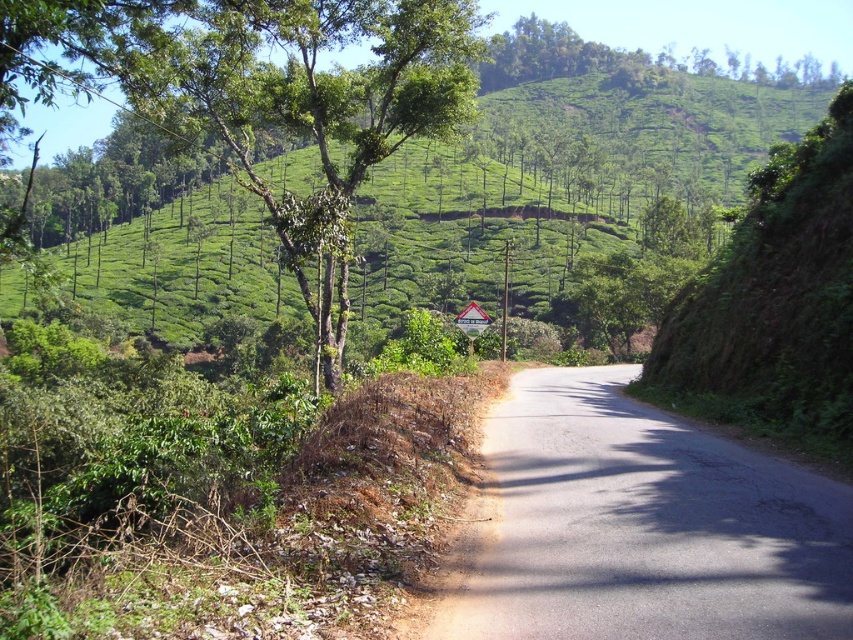
You are standing at point A located at coordinates (641, 525) in the image. What object is exactly at your current location?

The asphalt road at center is exactly at point A located at coordinates (641, 525).